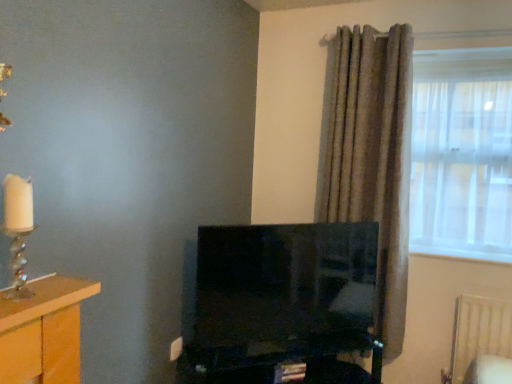
Where is `translucent glass candle holder at left`? This screenshot has width=512, height=384. translucent glass candle holder at left is located at coordinates (18, 229).

Is translucent glass candle holder at left oriented towards textured gray curtain at right?

No, translucent glass candle holder at left is not facing towards textured gray curtain at right.

Considering the sizes of objects translucent glass candle holder at left and textured gray curtain at right in the image provided, who is wider, translucent glass candle holder at left or textured gray curtain at right?

textured gray curtain at right is wider.

Is point (22, 274) more distant than point (349, 141)?

No, (22, 274) is in front of (349, 141).

Considering the positions of objects translucent glass candle holder at left and textured gray curtain at right in the image provided, who is more to the right, translucent glass candle holder at left or textured gray curtain at right?

From the viewer's perspective, textured gray curtain at right appears more on the right side.

Can you confirm if translucent fabric window at right is shorter than black glossy computer desk at center?

Incorrect, the height of translucent fabric window at right does not fall short of that of black glossy computer desk at center.

From a real-world perspective, is translucent fabric window at right above or below black glossy computer desk at center?

In terms of real-world spatial position, translucent fabric window at right is above black glossy computer desk at center.

In the image, is translucent fabric window at right on the left side or the right side of black glossy computer desk at center?

translucent fabric window at right is positioned on black glossy computer desk at center's right side.

Does point (428, 171) come closer to viewer compared to point (294, 346)?

No, (428, 171) is further to viewer.

Would you say wooden table at left is inside or outside textured gray curtain at right?

wooden table at left is located beyond the bounds of textured gray curtain at right.

From the picture: From a real-world perspective, which object rests below the other?

wooden table at left is physically lower.

Which is behind, point (53, 310) or point (384, 227)?

Positioned behind is point (384, 227).

In terms of height, does wooden table at left look taller or shorter compared to textured gray curtain at right?

Considering their sizes, wooden table at left has less height than textured gray curtain at right.

Looking at this image, between translucent fabric window at right and wooden table at left, which one has smaller width?

Thinner between the two is translucent fabric window at right.

Locate an element on the screen. This screenshot has height=384, width=512. furniture on the left of translucent fabric window at right is located at coordinates (42, 332).

What's the angular difference between translucent fabric window at right and wooden table at left's facing directions?

The facing directions of translucent fabric window at right and wooden table at left are 89.6 degrees apart.

This screenshot has height=384, width=512. I want to click on window above the textured gray curtain at right (from the image's perspective), so click(x=462, y=153).

Which point is more forward, (439, 119) or (390, 294)?

Point (390, 294)

From a real-world perspective, who is located lower, translucent fabric window at right or textured gray curtain at right?

From a 3D spatial view, textured gray curtain at right is below.

Can you tell me how much translucent fabric window at right and textured gray curtain at right differ in facing direction?

There is a 3.43-degree angle between the facing directions of translucent fabric window at right and textured gray curtain at right.

Could you tell me if translucent glass candle holder at left is turned towards wooden table at left?

No, translucent glass candle holder at left is not aimed at wooden table at left.

Is translucent glass candle holder at left to the left or to the right of wooden table at left in the image?

translucent glass candle holder at left is positioned on wooden table at left's left side.

Is wooden table at left located within translucent glass candle holder at left?

That's incorrect, wooden table at left is not inside translucent glass candle holder at left.

Based on their sizes in the image, would you say black glossy computer desk at center is bigger or smaller than translucent fabric window at right?

Considering their sizes, black glossy computer desk at center takes up more space than translucent fabric window at right.

Based on the photo, which is nearer, (297, 376) or (482, 159)?

Clearly, point (297, 376) is closer to the camera than point (482, 159).

Is black glossy computer desk at center taller than translucent fabric window at right?

In fact, black glossy computer desk at center may be shorter than translucent fabric window at right.

From the image's perspective, would you say black glossy computer desk at center is shown under translucent fabric window at right?

Indeed, from the image's perspective, black glossy computer desk at center is shown beneath translucent fabric window at right.

Image resolution: width=512 pixels, height=384 pixels. In the image, there is a translucent glass candle holder at left. Find the location of `curtain above it (from the image's perspective)`. curtain above it (from the image's perspective) is located at coordinates (371, 155).

Locate an element on the screen. window that appears on the right of black glossy computer desk at center is located at coordinates (462, 153).

Looking at the image, which one is located closer to textured gray curtain at right, matte black tv at center or translucent fabric window at right?

Among the two, translucent fabric window at right is located nearer to textured gray curtain at right.

Looking at the image, which one is located closer to translucent fabric window at right, matte black tv at center or wooden table at left?

matte black tv at center is closer to translucent fabric window at right.

Looking at this image, considering their positions, is textured gray curtain at right positioned further to translucent fabric window at right than matte black tv at center?

matte black tv at center is further to translucent fabric window at right.

Based on their spatial positions, is wooden table at left or translucent glass candle holder at left closer to black glossy computer desk at center?

wooden table at left lies closer to black glossy computer desk at center than the other object.

Considering their positions, is textured gray curtain at right positioned closer to wooden table at left than translucent glass candle holder at left?

translucent glass candle holder at left is closer to wooden table at left.

Based on their spatial positions, is translucent fabric window at right or black glossy computer desk at center further from textured gray curtain at right?

black glossy computer desk at center.

Considering their positions, is black glossy computer desk at center positioned closer to matte black tv at center than textured gray curtain at right?

The object closer to matte black tv at center is black glossy computer desk at center.

Considering their positions, is matte black tv at center positioned further to translucent fabric window at right than black glossy computer desk at center?

Among the two, black glossy computer desk at center is located further to translucent fabric window at right.

This screenshot has height=384, width=512. I want to click on television between translucent glass candle holder at left and textured gray curtain at right, so tap(284, 283).

The image size is (512, 384). I want to click on curtain between translucent glass candle holder at left and translucent fabric window at right in the horizontal direction, so click(x=371, y=155).

Where is `curtain situated between matte black tv at center and translucent fabric window at right from left to right`? The image size is (512, 384). curtain situated between matte black tv at center and translucent fabric window at right from left to right is located at coordinates 371,155.

Where is `computer desk between translucent glass candle holder at left and translucent fabric window at right from left to right`? computer desk between translucent glass candle holder at left and translucent fabric window at right from left to right is located at coordinates (283, 361).